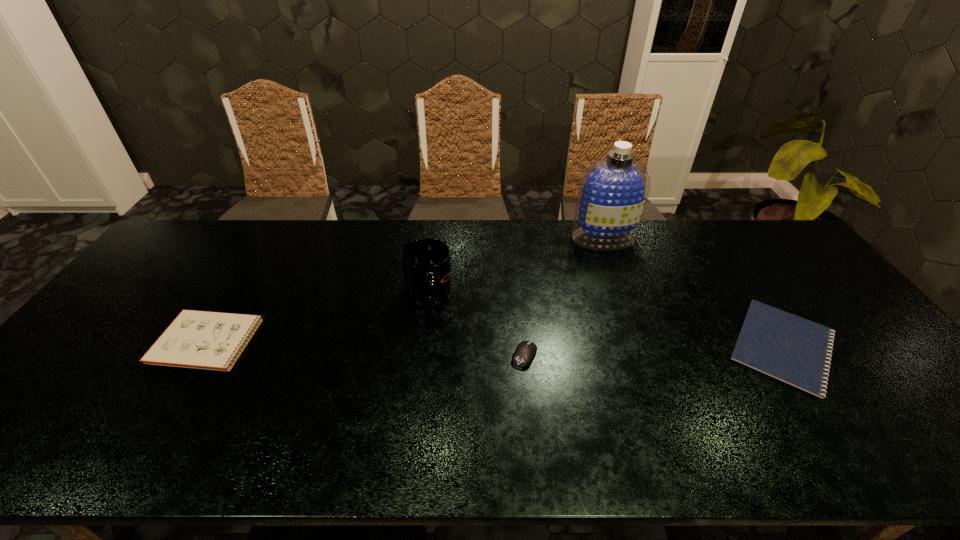
This screenshot has width=960, height=540. In order to click on the fourth object from left to right in this screenshot , I will do `click(612, 193)`.

At what (x,y) coordinates should I click in order to perform the action: click on the tallest object. Please return your answer as a coordinate pair (x, y). This screenshot has height=540, width=960. Looking at the image, I should click on (612, 193).

Where is `mug`? mug is located at coordinates (426, 263).

You are a GUI agent. You are given a task and a screenshot of the screen. Output one action in this format:
    pyautogui.click(x=<x>, y=<y>)
    Task: Click on the fourth object from right to left
    The height and width of the screenshot is (540, 960).
    Given the screenshot: What is the action you would take?
    pyautogui.click(x=426, y=263)

This screenshot has height=540, width=960. What are the coordinates of `the taller notepad` in the screenshot? It's located at (208, 340).

You are a GUI agent. You are given a task and a screenshot of the screen. Output one action in this format:
    pyautogui.click(x=<x>, y=<y>)
    Task: Click on the leftmost object
    The width and height of the screenshot is (960, 540).
    Given the screenshot: What is the action you would take?
    [208, 340]

Where is `the third object from right to left`? the third object from right to left is located at coordinates coord(525,351).

Find the location of `the shorter notepad`. the shorter notepad is located at coordinates (796, 351).

Image resolution: width=960 pixels, height=540 pixels. Identify the location of the shortest object. (796, 351).

Where is `blank space located 0.220m on the front of the farthest object`? The image size is (960, 540). blank space located 0.220m on the front of the farthest object is located at coordinates pos(625,298).